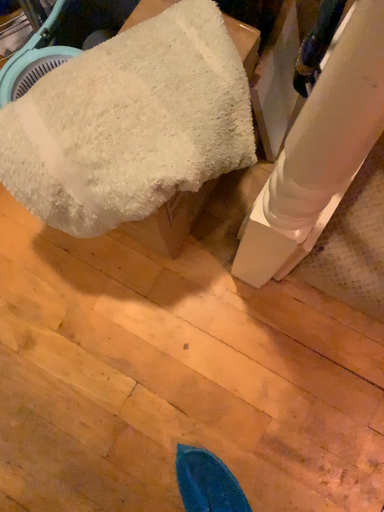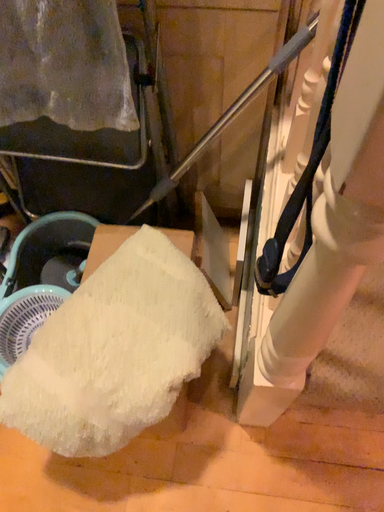
Question: How did the camera likely rotate when shooting the video?

Choices:
 (A) rotated downward
 (B) rotated upward

Answer: (B)